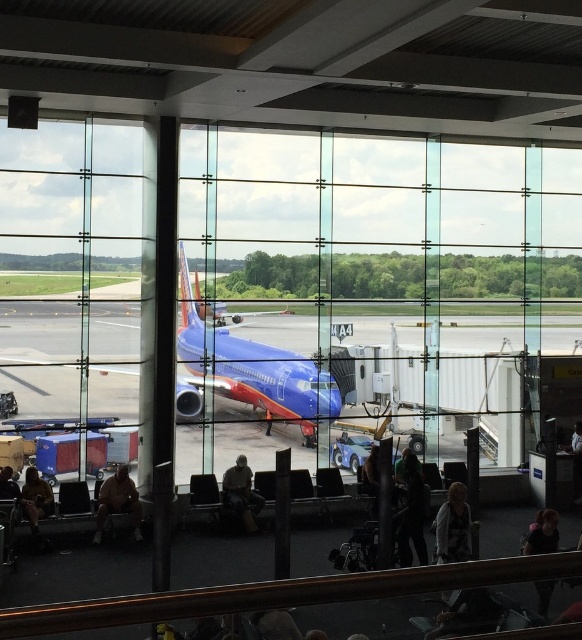
Question: Which object is the closest to the light gray fabric jacket at lower center?

Choices:
 (A) dark green fabric jacket at center
 (B) camouflage fabric jacket at center
 (C) light brown leather jacket at lower left

Answer: (A)

Question: Is dark green fabric jacket at center above light gray fabric jacket at lower center?

Choices:
 (A) yes
 (B) no

Answer: (B)

Question: Does light gray fabric jacket at lower center have a smaller size compared to light brown leather jacket at lower left?

Choices:
 (A) no
 (B) yes

Answer: (A)

Question: Which point is farther from the camera taking this photo?

Choices:
 (A) (102, 516)
 (B) (425, 554)
 (C) (528, 547)
 (D) (31, 520)

Answer: (A)

Question: Which object is the closest to the light brown leather jacket at lower left?

Choices:
 (A) light gray fabric jacket at lower center
 (B) camouflage fabric jacket at center

Answer: (B)

Question: Can you confirm if light brown leather jacket at lower left is positioned above dark brown leather jacket at lower right?

Choices:
 (A) no
 (B) yes

Answer: (A)